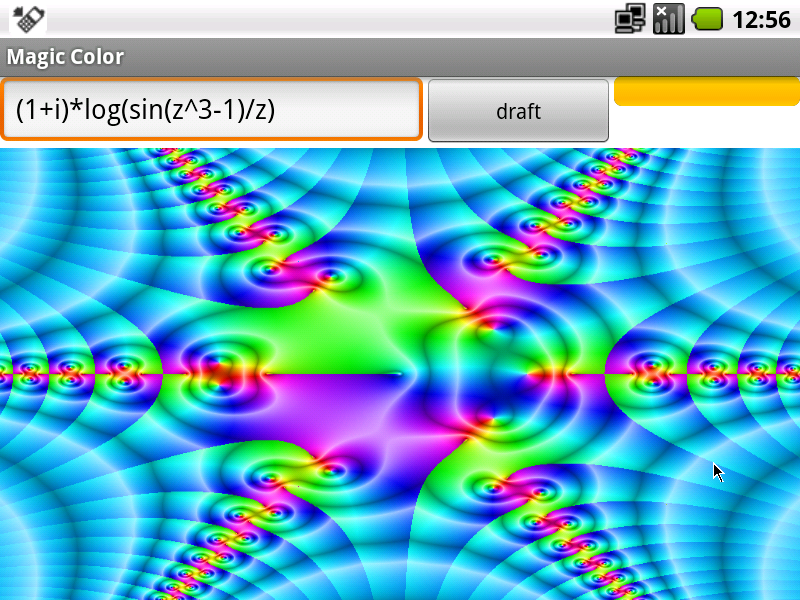
This screenshot has width=800, height=600. I want to click on screen, so click(34, 16).